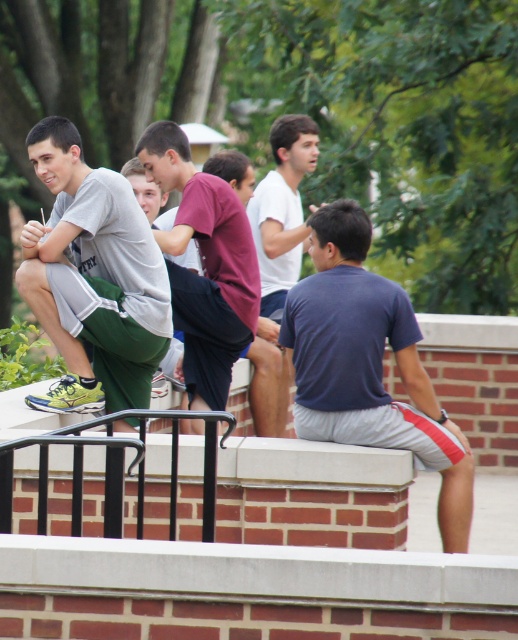
Question: Which point is farther to the camera?

Choices:
 (A) white matte shirt at center
 (B) dark blue t-shirt at center
 (C) matte maroon shirt at center
 (D) black metal rail at lower left

Answer: (A)

Question: Which point is closer to the camera?

Choices:
 (A) matte gray t-shirt at left
 (B) dark blue t-shirt at center
 (C) white matte shirt at center
 (D) black metal rail at lower left

Answer: (D)

Question: Which object is positioned closest to the white matte shirt at center?

Choices:
 (A) black metal rail at lower left
 (B) matte maroon shirt at center
 (C) dark blue t-shirt at center

Answer: (B)

Question: Can you confirm if matte gray t-shirt at left is positioned below black metal rail at lower left?

Choices:
 (A) no
 (B) yes

Answer: (A)

Question: Is matte gray t-shirt at left above dark blue t-shirt at center?

Choices:
 (A) yes
 (B) no

Answer: (A)

Question: Can you confirm if white matte shirt at center is smaller than black metal rail at lower left?

Choices:
 (A) yes
 (B) no

Answer: (B)